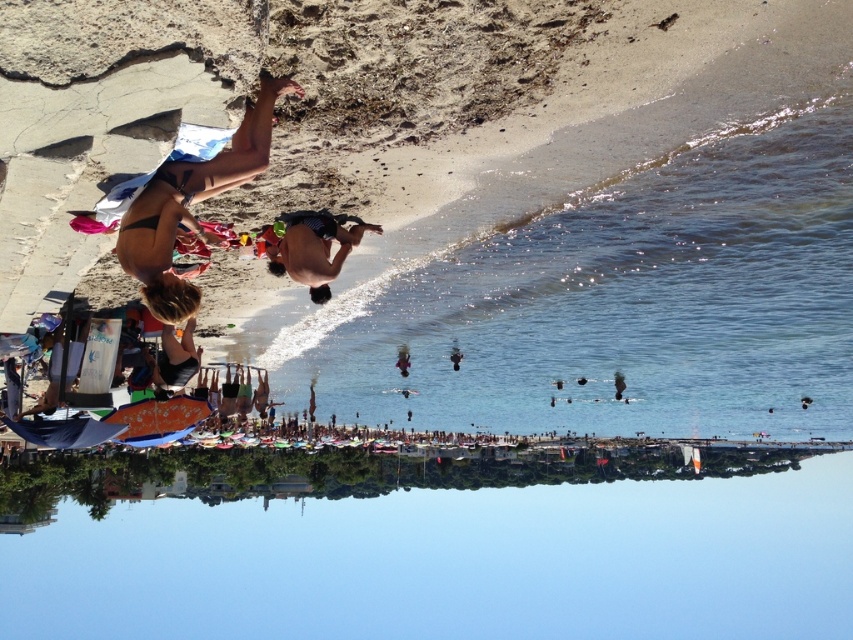
You are a photographer trying to capture a shot of the matte black bikini at lower left and the clear blue water at lower center. Based on the scene, which object is closer to the camera?

The matte black bikini at lower left is closer to the camera because the clear blue water at lower center is positioned under it, indicating it is behind the bikini.

You are standing on the beach and want to find the clear blue water at lower center. According to the scene, where should you look relative to your position?

The clear blue water at lower center is located at point (x=451, y=563), so you should look towards the lower center direction from your current position on the beach.

You are a photographer trying to capture a shot of the clear blue water at lower center and the matte black bikini at lower left. Which object will appear larger in your photo?

The clear blue water at lower center will appear larger in the photo because it is bigger than the matte black bikini at lower left.